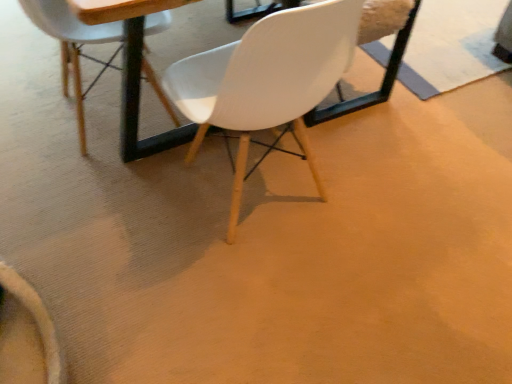
Question: From the image's perspective, is matte white chair at upper center, which appears as the first chair when viewed from the left, above or below wooden round table at center?

Choices:
 (A) below
 (B) above

Answer: (A)

Question: Is matte white chair at upper center, which appears as the first chair when viewed from the left, wider or thinner than wooden round table at center?

Choices:
 (A) wide
 (B) thin

Answer: (B)

Question: Estimate the real-world distances between objects in this image. Which object is farther from the wooden round table at center?

Choices:
 (A) white matte chair at center, the second chair from the left
 (B) matte white chair at upper center, which appears as the first chair when viewed from the left

Answer: (A)

Question: Which object is positioned closest to the white matte chair at center, acting as the 1th chair starting from the right?

Choices:
 (A) matte white chair at upper center, which appears as the first chair when viewed from the left
 (B) wooden round table at center

Answer: (B)